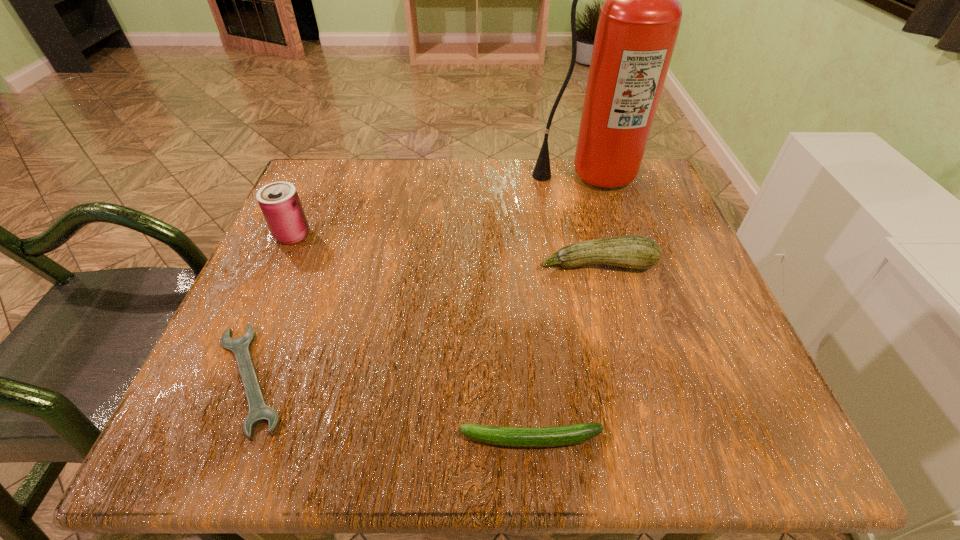
The height and width of the screenshot is (540, 960). I want to click on vacant point located on the front of the second tallest object, so click(207, 423).

The image size is (960, 540). I want to click on vacant region located 0.150m at the stem end of the taller zucchini, so click(618, 343).

Identify the location of vacant region located 0.320m on the front-facing side of the shorter zucchini. The image size is (960, 540). (226, 439).

Locate an element on the screen. This screenshot has height=540, width=960. vacant region located on the front-facing side of the shorter zucchini is located at coordinates (270, 439).

This screenshot has width=960, height=540. I want to click on vacant space located 0.390m on the front-facing side of the shorter zucchini, so click(x=175, y=439).

Image resolution: width=960 pixels, height=540 pixels. What are the coordinates of `free space located 0.150m on the back of the shortest object` in the screenshot? It's located at (297, 264).

Where is `object that is positioned at the far edge`? object that is positioned at the far edge is located at coordinates (639, 21).

At what (x,y) coordinates should I click in order to perform the action: click on zucchini that is at the near edge. Please return your answer as a coordinate pair (x, y). Looking at the image, I should click on (554, 436).

Locate an element on the screen. wrench that is at the near edge is located at coordinates (259, 412).

Where is `can that is at the left edge`? The image size is (960, 540). can that is at the left edge is located at coordinates (279, 202).